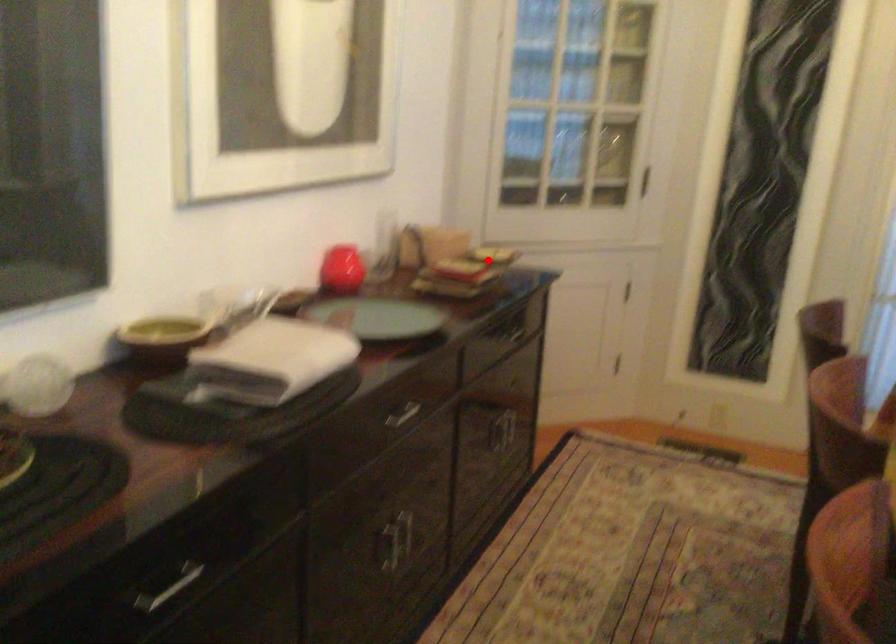
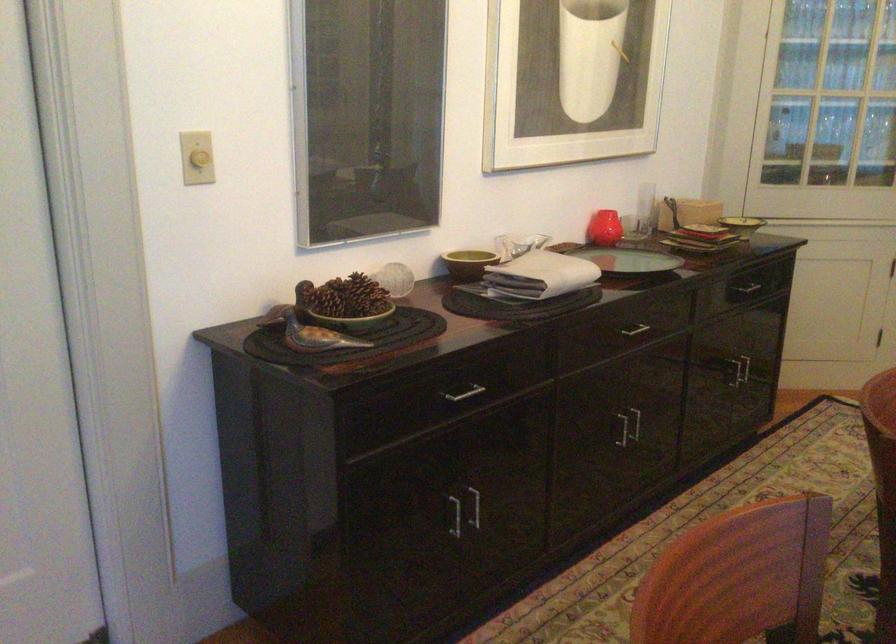
Question: I am providing you with two images of the same scene from different viewpoints. In image1, a red point is highlighted. Considering the same 3D point in image2, which of the following is correct?

Choices:
 (A) It is closer
 (B) It is farther

Answer: (B)